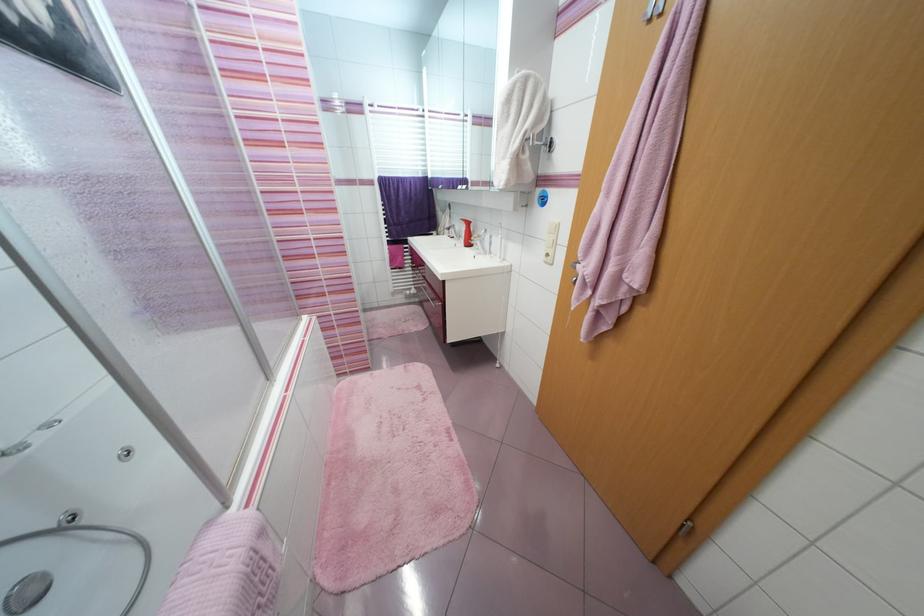
Identify the location of over-door towel hook. (549, 145).